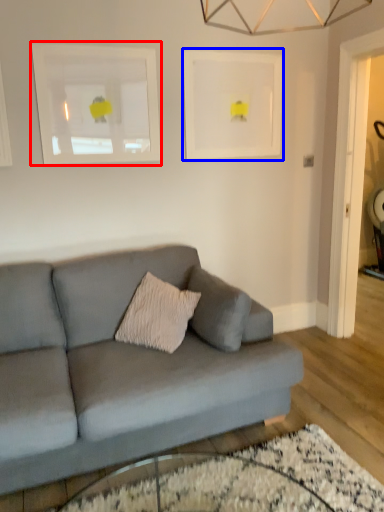
Question: Among these objects, which one is farthest to the camera, picture frame (highlighted by a red box) or picture frame (highlighted by a blue box)?

Choices:
 (A) picture frame
 (B) picture frame

Answer: (B)